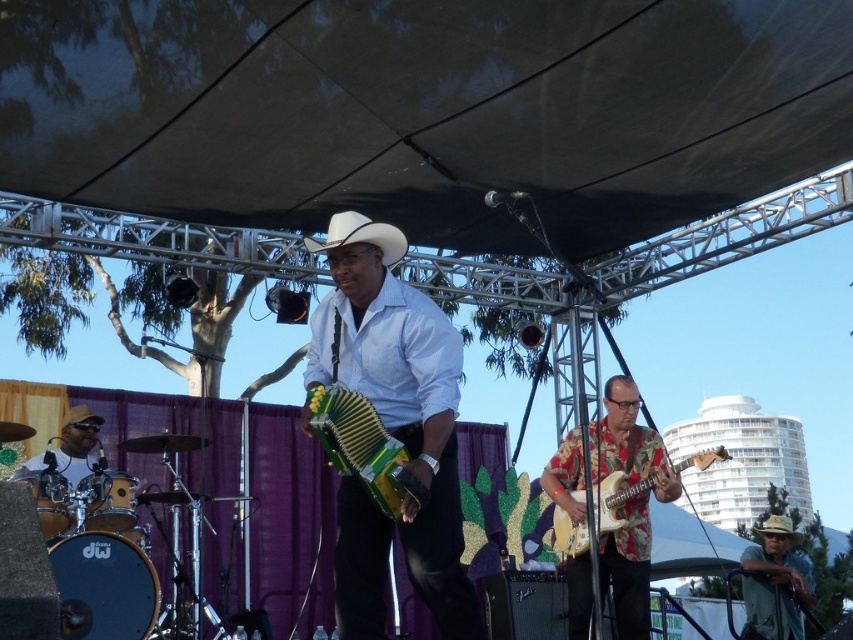
You are a stagehand who needs to move a 1.5 meter long equipment cart from the back of the stage to the front. There is a path between the green matte accordion at center and the floral fabric guitar at right. Can the cart pass through this path?

The distance between the green matte accordion at center and the floral fabric guitar at right is 1.67 meters. Since the cart is 1.5 meters long, it can pass through the path as the space is wider than the cart.

You are a photographer at the event and want to capture both the green fabric hat at lower right and the floral fabric guitar at center in a single photo. Which object should you focus on first to ensure both are in clear view?

You should focus on the green fabric hat at lower right first because it is closer to you than the floral fabric guitar at center, so focusing on it will keep both in focus.